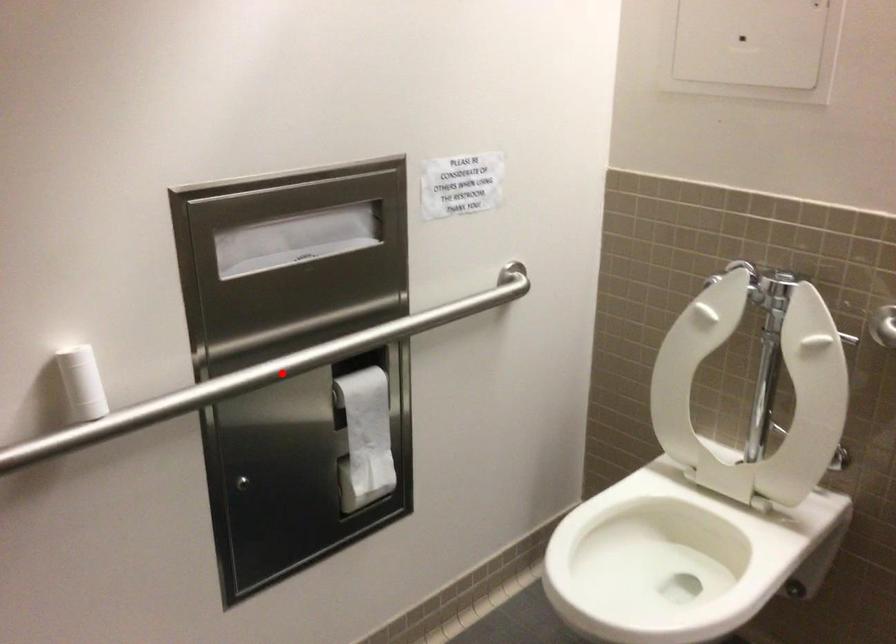
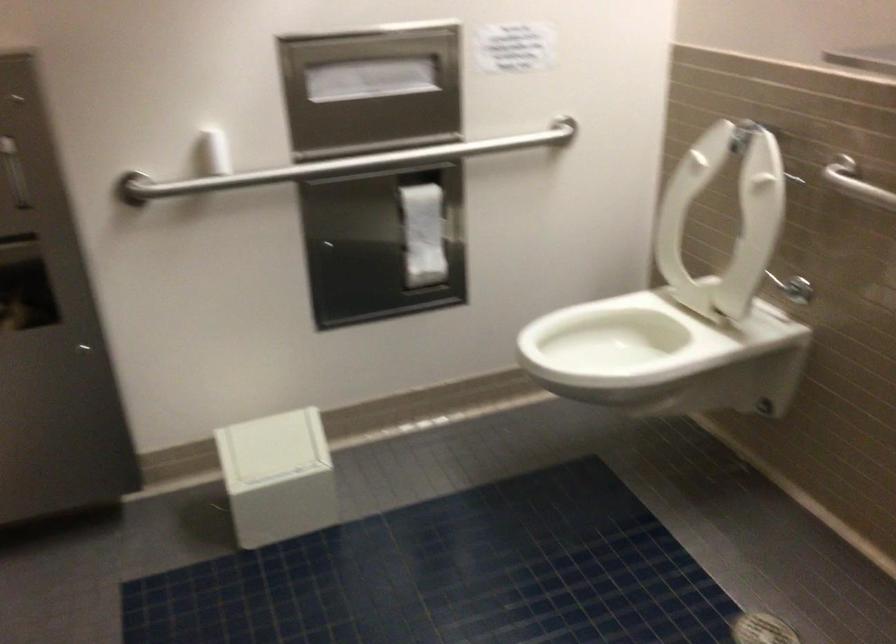
Where in the second image is the point corresponding to the highlighted location from the first image?

(343, 165)